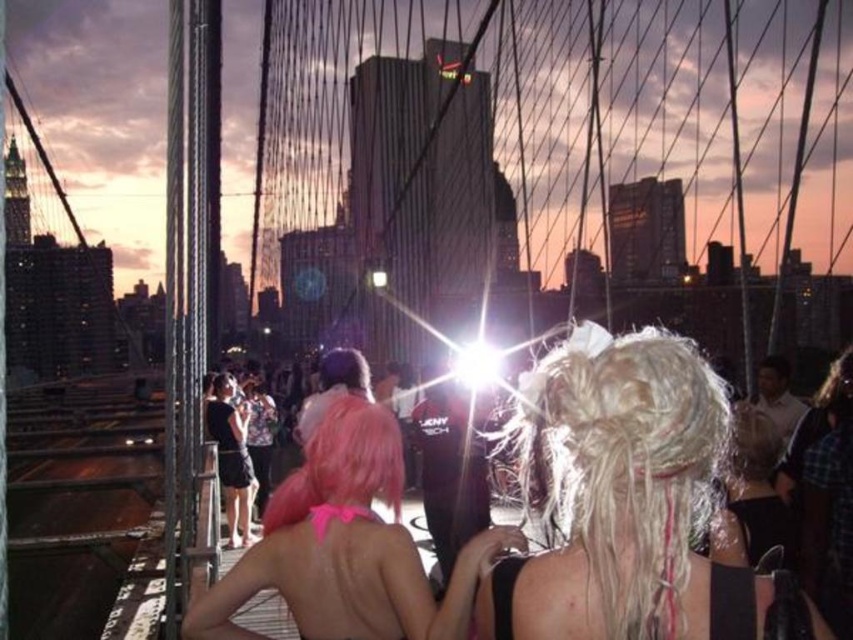
Which of these two, pink matte wig at center or pink matte hair at center, stands shorter?

With less height is pink matte hair at center.

Does pink matte wig at center lie in front of pink matte hair at center?

Yes, pink matte wig at center is in front of pink matte hair at center.

Between point (344, 612) and point (368, 403), which one is positioned behind?

The point (368, 403) is more distant.

The image size is (853, 640). I want to click on pink matte wig at center, so click(347, 547).

Describe the element at coordinates (628, 502) in the screenshot. I see `blonde hair at center` at that location.

From the picture: Who is higher up, blonde hair at center or pink matte hair at center?

blonde hair at center

Image resolution: width=853 pixels, height=640 pixels. What do you see at coordinates (628, 502) in the screenshot?
I see `blonde hair at center` at bounding box center [628, 502].

Where is `blonde hair at center`? blonde hair at center is located at coordinates (628, 502).

Who is positioned more to the right, blonde hair at center or pink matte wig at center?

blonde hair at center

Does blonde hair at center have a lesser width compared to pink matte wig at center?

Correct, blonde hair at center's width is less than pink matte wig at center's.

Does point (595, 492) come closer to viewer compared to point (242, 588)?

Yes, it is.

Identify the location of blonde hair at center. This screenshot has height=640, width=853. (628, 502).